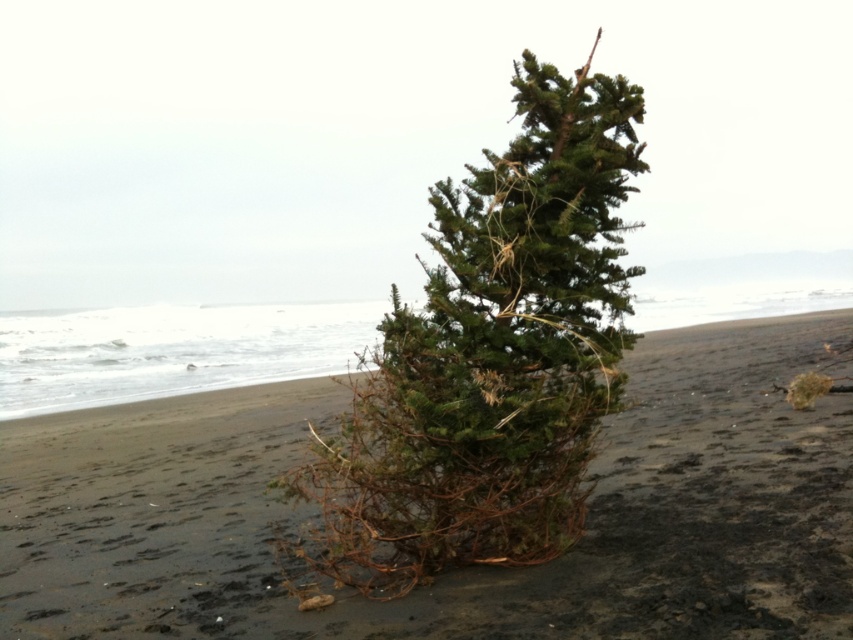
Question: Is dark brown sand at center below green needle-like at center?

Choices:
 (A) no
 (B) yes

Answer: (B)

Question: Is dark brown sand at center positioned before green needle-like at center?

Choices:
 (A) no
 (B) yes

Answer: (B)

Question: Which point is farther to the camera?

Choices:
 (A) (489, 454)
 (B) (796, 545)

Answer: (A)

Question: Which of the following is the closest to the observer?

Choices:
 (A) (715, 531)
 (B) (401, 490)

Answer: (B)

Question: Where is dark brown sand at center located in relation to green needle-like at center in the image?

Choices:
 (A) right
 (B) left

Answer: (B)